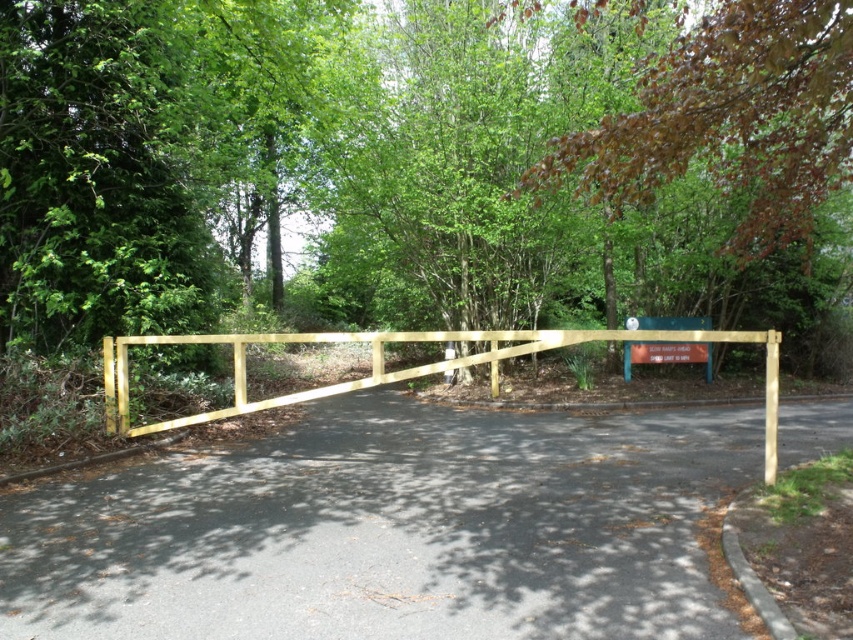
Can you confirm if brown leafy tree at upper right is positioned to the right of blue painted wood sign at center?

In fact, brown leafy tree at upper right is to the left of blue painted wood sign at center.

Does point (782, 141) lie in front of point (688, 346)?

Yes, it is in front of point (688, 346).

The height and width of the screenshot is (640, 853). I want to click on brown leafy tree at upper right, so click(x=730, y=118).

Is brown leafy tree at upper right positioned before yellow wood fence at center?

No, it is behind yellow wood fence at center.

Does point (746, 173) come farther from viewer compared to point (398, 333)?

That is True.

Which is behind, point (820, 99) or point (331, 333)?

The point (331, 333) is more distant.

Where is `brown leafy tree at upper right`? The image size is (853, 640). brown leafy tree at upper right is located at coordinates (730, 118).

Does yellow wooden fence at center have a larger size compared to brown leafy tree at upper right?

Indeed, yellow wooden fence at center has a larger size compared to brown leafy tree at upper right.

Who is more distant from viewer, (642,422) or (554,170)?

The point (642,422) is more distant.

Describe the element at coordinates (390, 531) in the screenshot. I see `yellow wooden fence at center` at that location.

The width and height of the screenshot is (853, 640). I want to click on yellow wooden fence at center, so click(x=390, y=531).